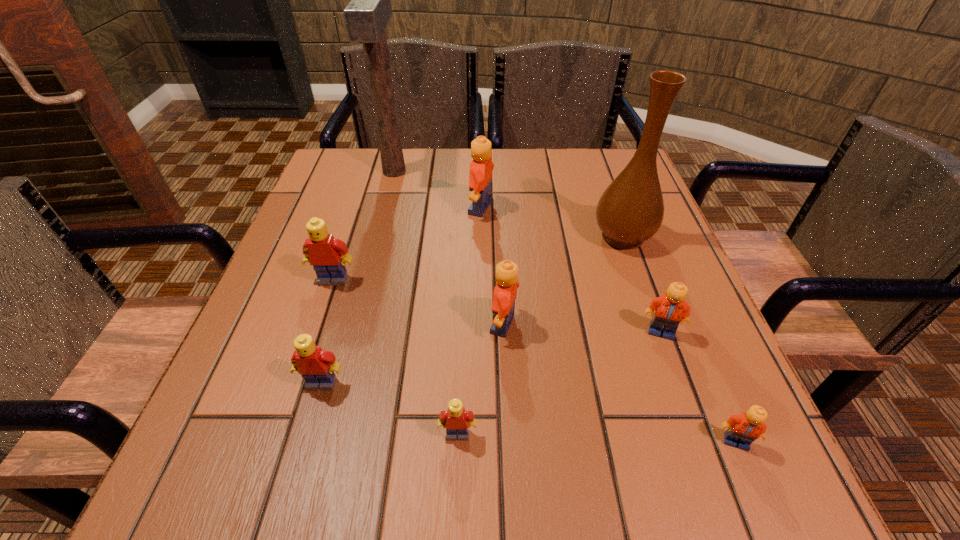
Image resolution: width=960 pixels, height=540 pixels. Identify the location of mallet situated at the left edge. (366, 16).

What are the coordinates of `vase that is at the right edge` in the screenshot? It's located at (630, 211).

At what (x,y) coordinates should I click in order to perform the action: click on object situated at the far left corner. Please return your answer as a coordinate pair (x, y). The height and width of the screenshot is (540, 960). Looking at the image, I should click on (366, 16).

The width and height of the screenshot is (960, 540). I want to click on object that is at the near right corner, so click(743, 429).

In the image, there is a desktop. Identify the location of vacant region at the far edge. The width and height of the screenshot is (960, 540). (538, 164).

At what (x,y) coordinates should I click in order to perform the action: click on vacant area at the near edge of the desktop. Please return your answer as a coordinate pair (x, y). Image resolution: width=960 pixels, height=540 pixels. Looking at the image, I should click on (447, 468).

Locate an element on the screen. free region at the left edge of the desktop is located at coordinates (253, 314).

In order to click on vacant space at the right edge in this screenshot , I will do `click(676, 282)`.

Find the location of a particular element. vacant space at the far left corner of the desktop is located at coordinates (331, 161).

Identify the location of free space between the fifth farthest Lego and the second biggest orange Lego. Image resolution: width=960 pixels, height=540 pixels. (413, 354).